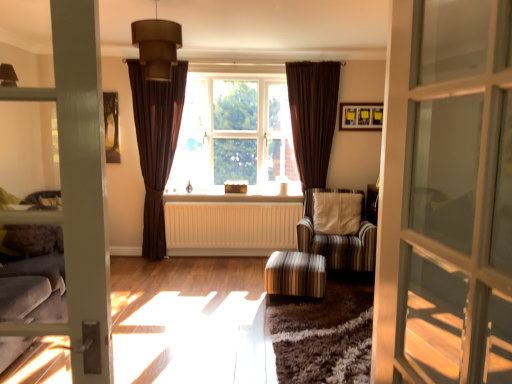
At what (x,y) coordinates should I click in order to perform the action: click on vacant space situated above brown velvet curtain at right, which ranks as the 1th curtain in right-to-left order (from a real-world perspective). Please return your answer as a coordinate pair (x, y). The height and width of the screenshot is (384, 512). Looking at the image, I should click on (311, 60).